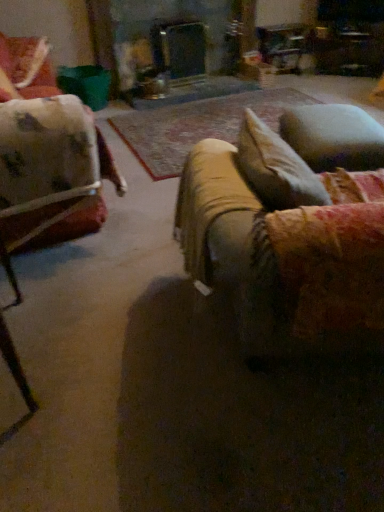
Question: Is velvety blue pillow at right not near velvet beige couch at center?

Choices:
 (A) no
 (B) yes

Answer: (A)

Question: Does velvety blue pillow at right have a smaller size compared to velvet beige couch at center?

Choices:
 (A) no
 (B) yes

Answer: (B)

Question: Is the depth of velvety blue pillow at right greater than that of velvet beige couch at center?

Choices:
 (A) yes
 (B) no

Answer: (A)

Question: From a real-world perspective, is velvety blue pillow at right beneath velvet beige couch at center?

Choices:
 (A) no
 (B) yes

Answer: (B)

Question: From the image's perspective, does velvety blue pillow at right appear lower than velvet beige couch at center?

Choices:
 (A) no
 (B) yes

Answer: (A)

Question: Does point (349, 202) appear closer or farther from the camera than point (312, 110)?

Choices:
 (A) closer
 (B) farther

Answer: (A)

Question: From a real-world perspective, is velvet beige couch at center above or below velvety blue pillow at right?

Choices:
 (A) above
 (B) below

Answer: (A)

Question: In terms of size, does velvet beige couch at center appear bigger or smaller than velvety blue pillow at right?

Choices:
 (A) small
 (B) big

Answer: (B)

Question: Would you say velvet beige couch at center is to the left or to the right of velvety blue pillow at right in the picture?

Choices:
 (A) right
 (B) left

Answer: (B)

Question: Considering their positions, is velvet floral chair at upper left located in front of or behind velvet beige couch at center?

Choices:
 (A) front
 (B) behind

Answer: (B)

Question: From a real-world perspective, relative to velvet beige couch at center, is velvet floral chair at upper left vertically above or below?

Choices:
 (A) below
 (B) above

Answer: (B)

Question: Is velvet floral chair at upper left to the left or to the right of velvet beige couch at center in the image?

Choices:
 (A) left
 (B) right

Answer: (A)

Question: From the image's perspective, is velvet floral chair at upper left located above or below velvet beige couch at center?

Choices:
 (A) above
 (B) below

Answer: (A)

Question: From a real-world perspective, is velvety blue pillow at right above or below velvet beige couch at center?

Choices:
 (A) above
 (B) below

Answer: (B)

Question: In the image, is velvety blue pillow at right on the left side or the right side of velvet beige couch at center?

Choices:
 (A) right
 (B) left

Answer: (A)